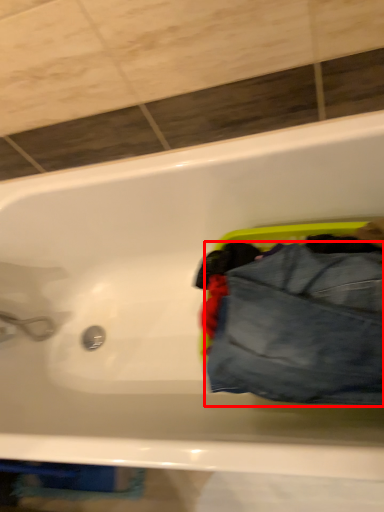
Question: Observing the image, what is the correct spatial positioning of trousers (annotated by the red box) in reference to bathtub?

Choices:
 (A) right
 (B) left

Answer: (A)